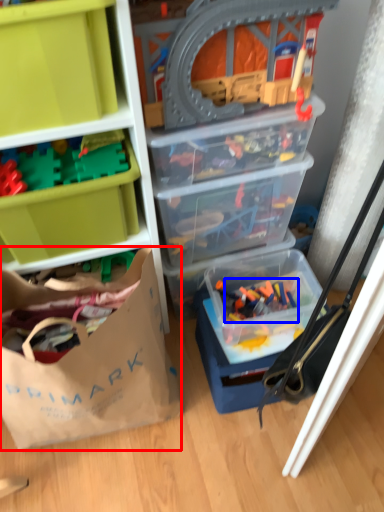
Question: Which of the following is the closest to the observer, handbag (highlighted by a red box) or toy (highlighted by a blue box)?

Choices:
 (A) handbag
 (B) toy

Answer: (A)